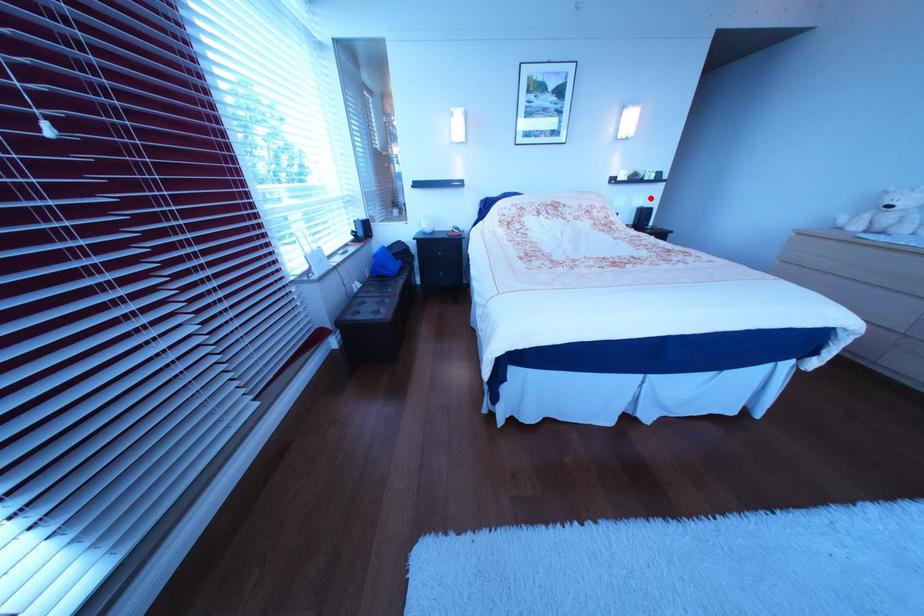
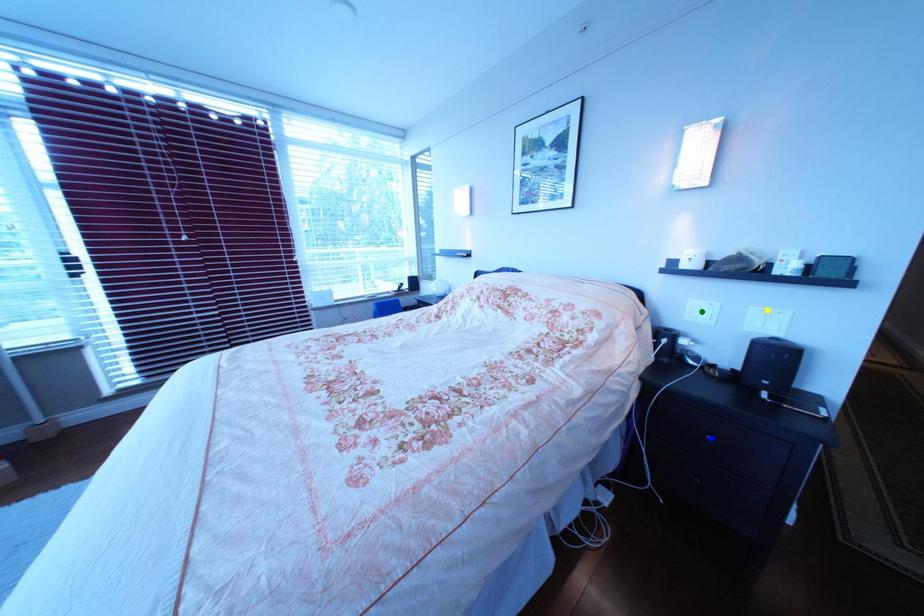
Question: I am providing you with two images of the same scene from different viewpoints. A red point is marked on the first image. You are given multiple points on the second image. Which point in image 2 represents the same 3d spot as the red point in image 1?

Choices:
 (A) green point
 (B) yellow point
 (C) blue point

Answer: (B)